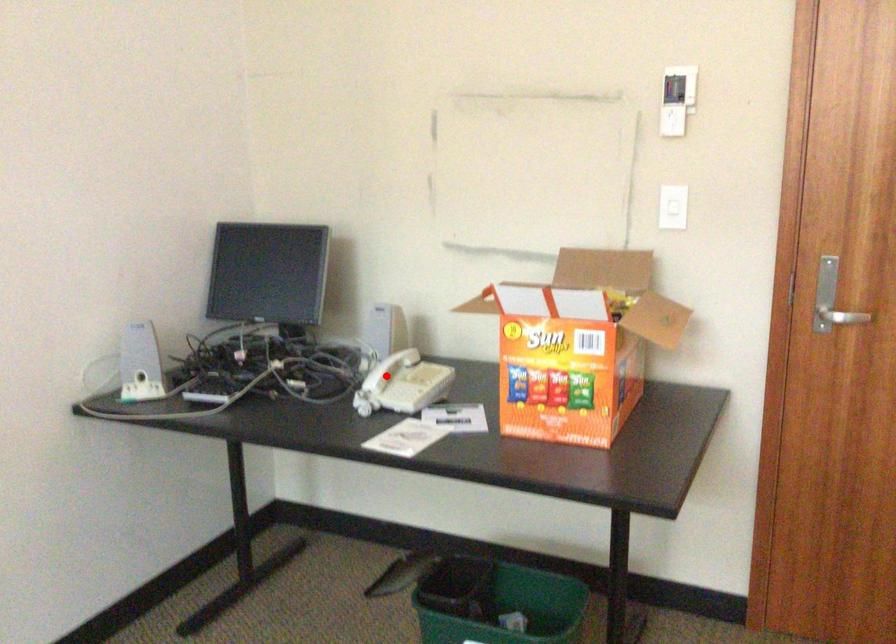
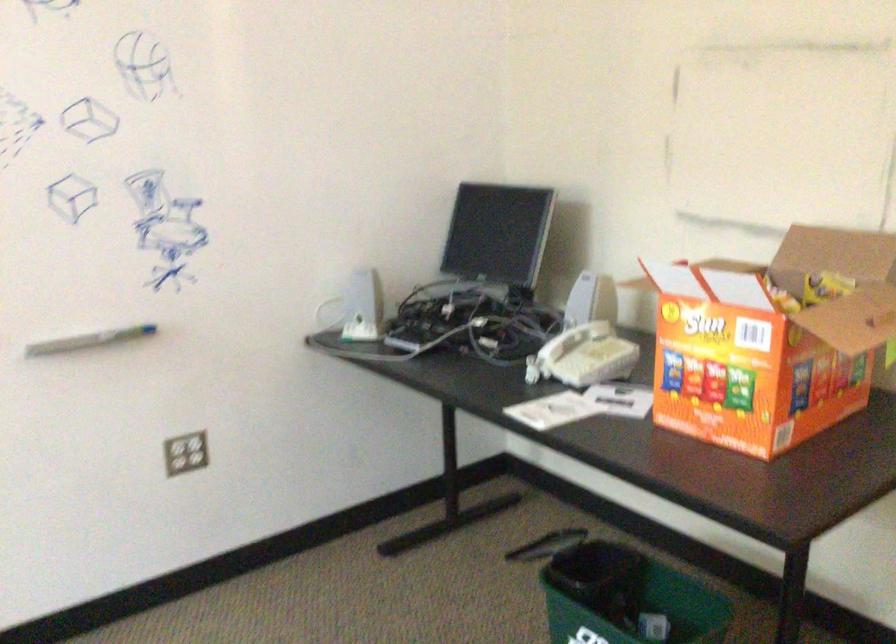
Where in the second image is the point corresponding to the highlighted location from the first image?

(558, 345)